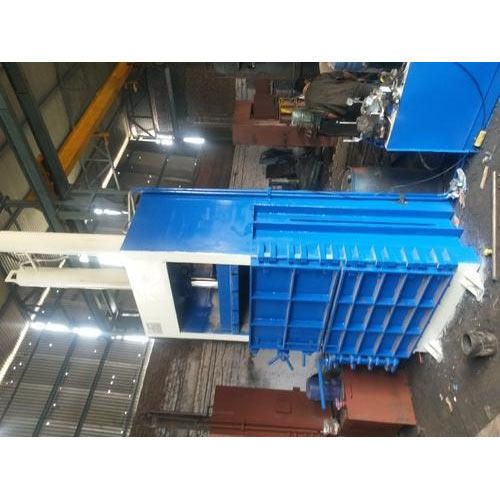
The image size is (500, 500). In order to click on yellow beam in this screenshot , I will do `click(79, 142)`.